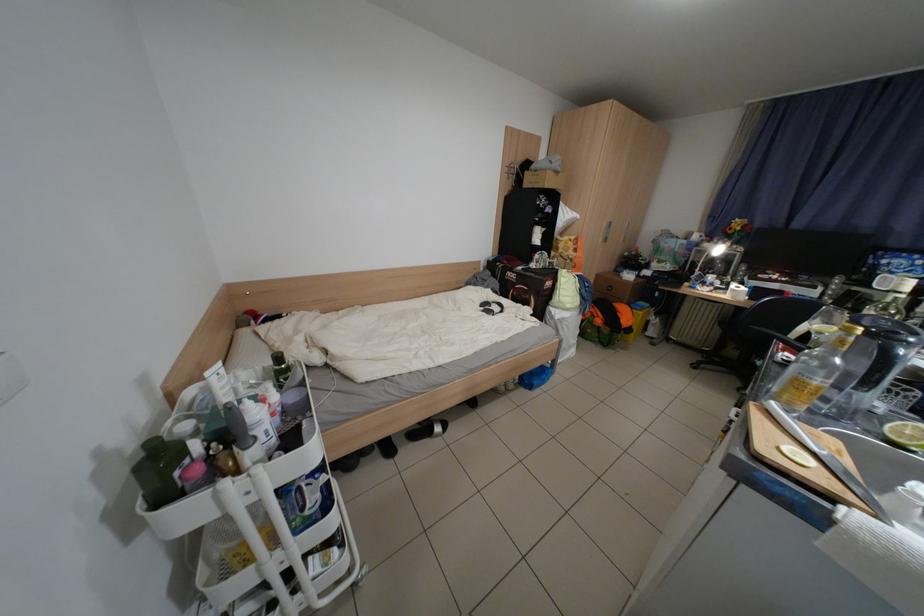
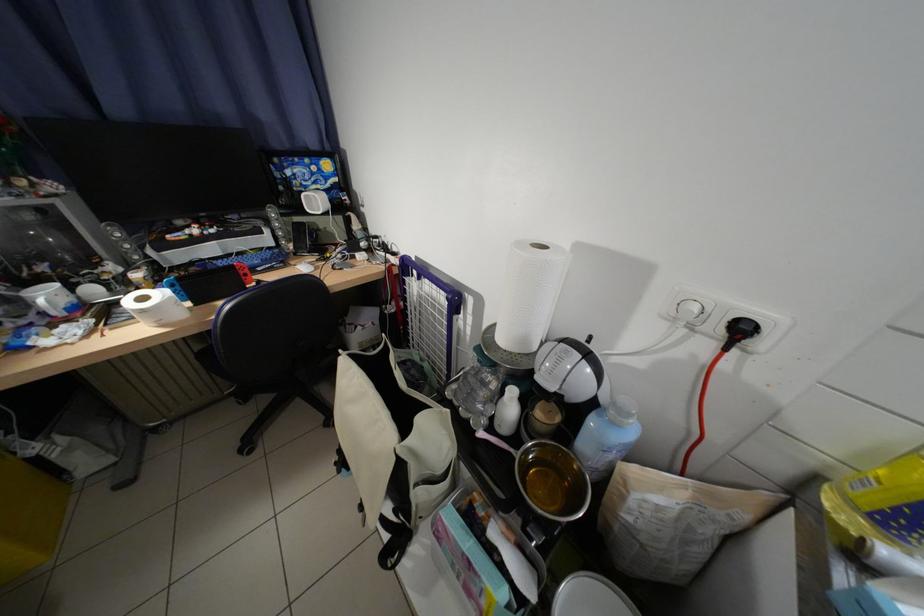
The point at [723,278] is marked in the first image. Where is the corresponding point in the second image?

(59, 297)